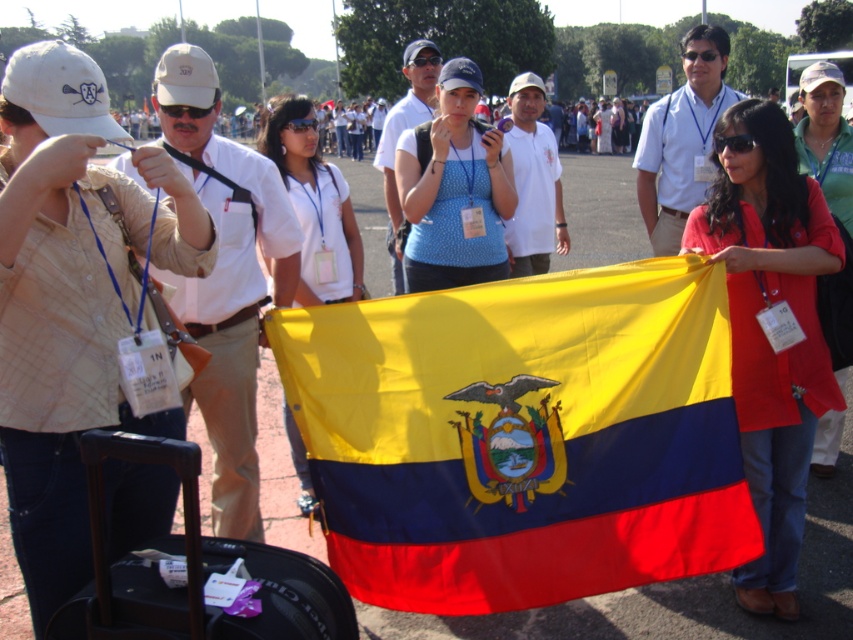
Is point (196, 548) less distant than point (724, 58)?

Yes.

In the scene shown: Who is more distant from viewer, (276, 564) or (677, 241)?

Point (677, 241)

This screenshot has height=640, width=853. I want to click on black hard suitcase at lower left, so click(193, 570).

Is point (285, 97) closer to camera compared to point (666, 163)?

Yes, it is in front of point (666, 163).

Can you confirm if yellow fabric flag at center is taller than matte white shirt at center?

Yes, yellow fabric flag at center is taller than matte white shirt at center.

The height and width of the screenshot is (640, 853). I want to click on yellow fabric flag at center, so coord(314,204).

Who is positioned more to the left, beige cotton cap at upper left or matte red jacket at lower right?

beige cotton cap at upper left is more to the left.

Does beige cotton cap at upper left have a greater height compared to matte red jacket at lower right?

Indeed, beige cotton cap at upper left has a greater height compared to matte red jacket at lower right.

Image resolution: width=853 pixels, height=640 pixels. Describe the element at coordinates (73, 301) in the screenshot. I see `beige cotton cap at upper left` at that location.

The height and width of the screenshot is (640, 853). I want to click on beige cotton cap at upper left, so click(73, 301).